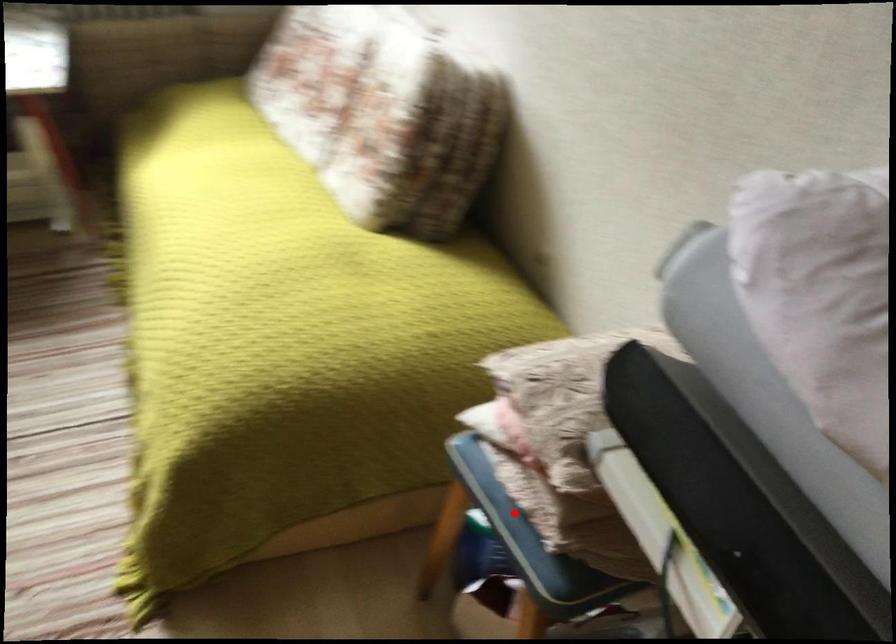
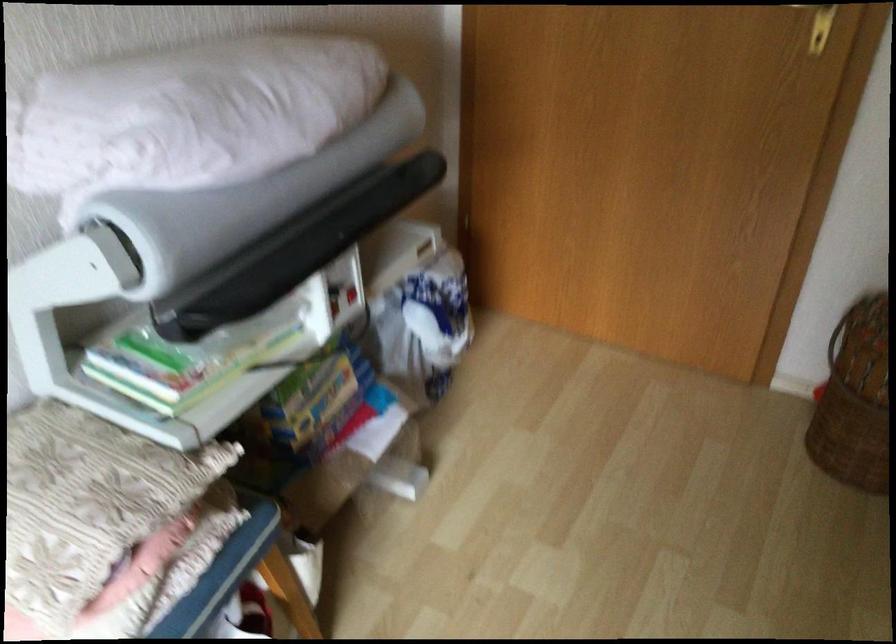
Where in the second image is the point corresponding to the highlighted location from the first image?

(222, 572)